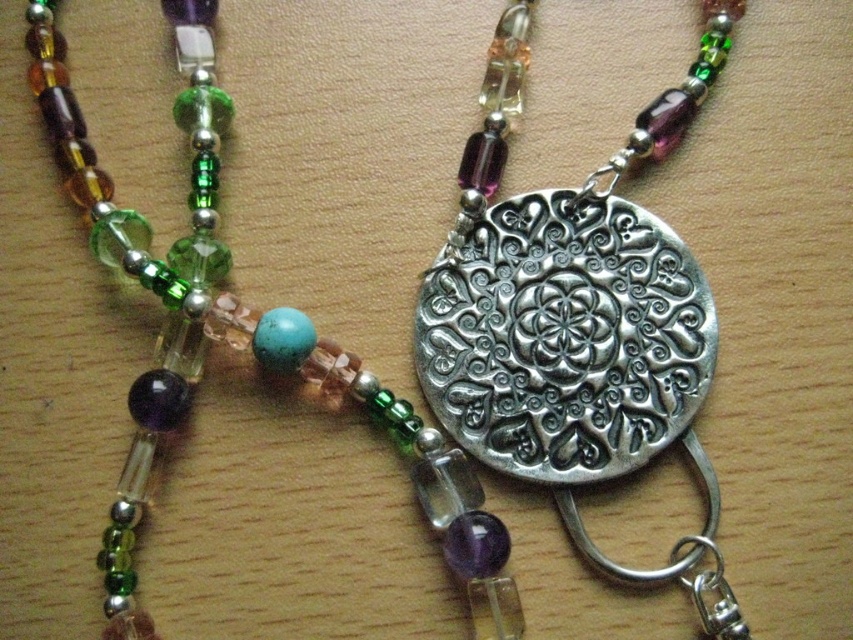
Looking at the necklace on the wooden surface, there are two medallions present. The silver textured medallion at center and the matte silver medallion at center. Which of these two medallions is taller?

The silver textured medallion at center is taller than the matte silver medallion at center according to the description.